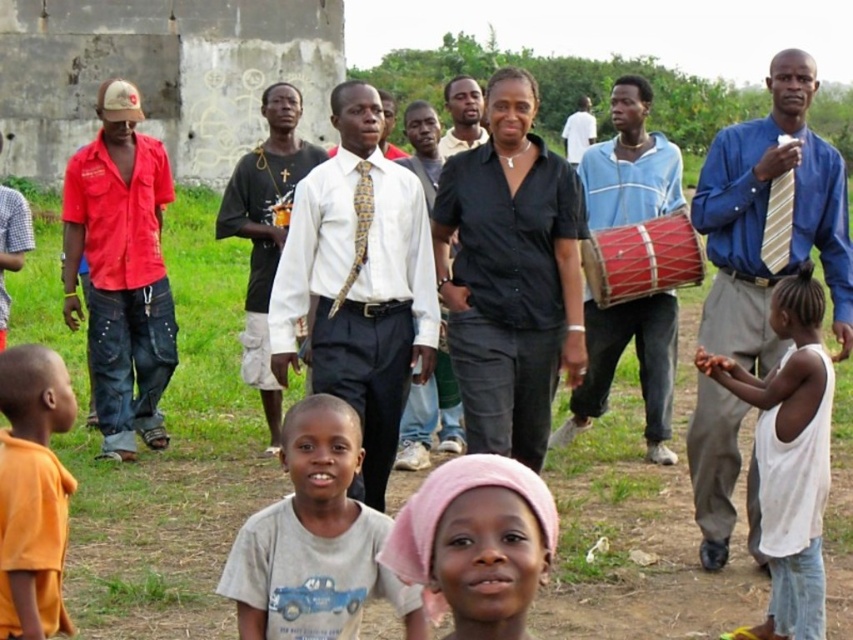
You are a photographer trying to capture a group photo of the blue shirt at center and the blue cotton shirt at center. Which one should you focus on first if you want to include both in the frame without moving the camera?

You should focus on the blue cotton shirt at center first because the blue shirt at center is positioned to its right, so adjusting focus to the left side of the frame would ensure both are in the shot.

You are a photographer standing at the camera position. You want to take a photo of the red denim shirt at left. Is the subject within your camera range? The camera has a maximum range of 40 meters.

The red denim shirt at left is 39.05 meters away from the camera, which is within the camera range of 40 meters. Therefore, the subject is within range and can be photographed.

You are standing at the origin of the coordinate system. You see a blue shirt at center located at point (770, 218). Is the blue shirt at center closer to the x or y axis?

The blue shirt at center is closer to the y axis because its x coordinate is 0.342 and y coordinate is 0.905. Since 0.342 is smaller than 0.905, it is closer to the y axis.